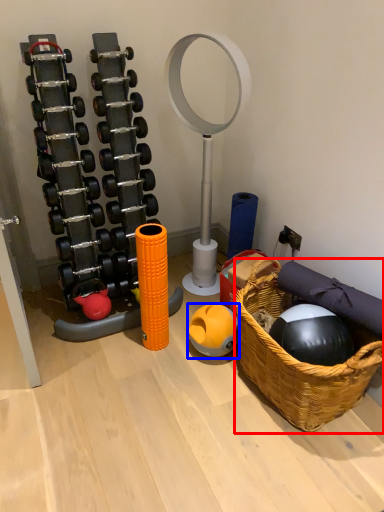
Question: Which of the following is the closest to the observer, basket (highlighted by a red box) or ball (highlighted by a blue box)?

Choices:
 (A) basket
 (B) ball

Answer: (A)